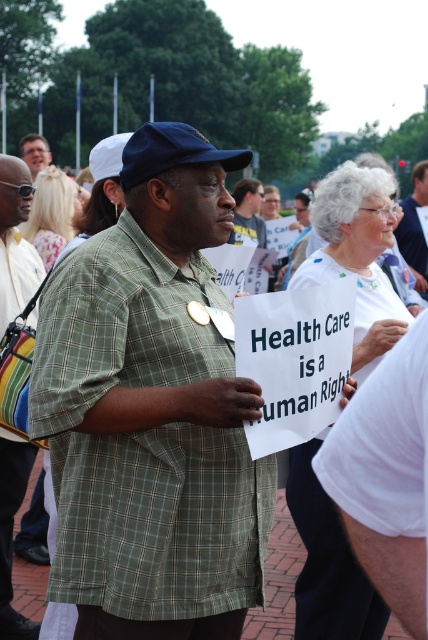
How much distance is there between green plaid shirt at center and matte black sign at center?

green plaid shirt at center and matte black sign at center are 16.97 feet apart.

Which is behind, point (415, 218) or point (35, 164)?

Point (35, 164)

The image size is (428, 640). In order to click on green plaid shirt at center in this screenshot , I will do `click(415, 227)`.

Can you confirm if multicolored striped bag at left is positioned below green plaid shirt at center?

Yes.

The image size is (428, 640). I want to click on multicolored striped bag at left, so click(15, 241).

Is point (2, 237) closer to camera compared to point (394, 232)?

Yes, point (2, 237) is closer to viewer.

Identify the location of multicolored striped bag at left. The image size is (428, 640). (15, 241).

Does multicolored striped bag at left have a greater width compared to matte black sign at center?

No.

Does multicolored striped bag at left appear under matte black sign at center?

Correct, multicolored striped bag at left is located below matte black sign at center.

Is point (14, 620) more distant than point (26, 144)?

No, it is not.

This screenshot has width=428, height=640. I want to click on multicolored striped bag at left, so click(x=15, y=241).